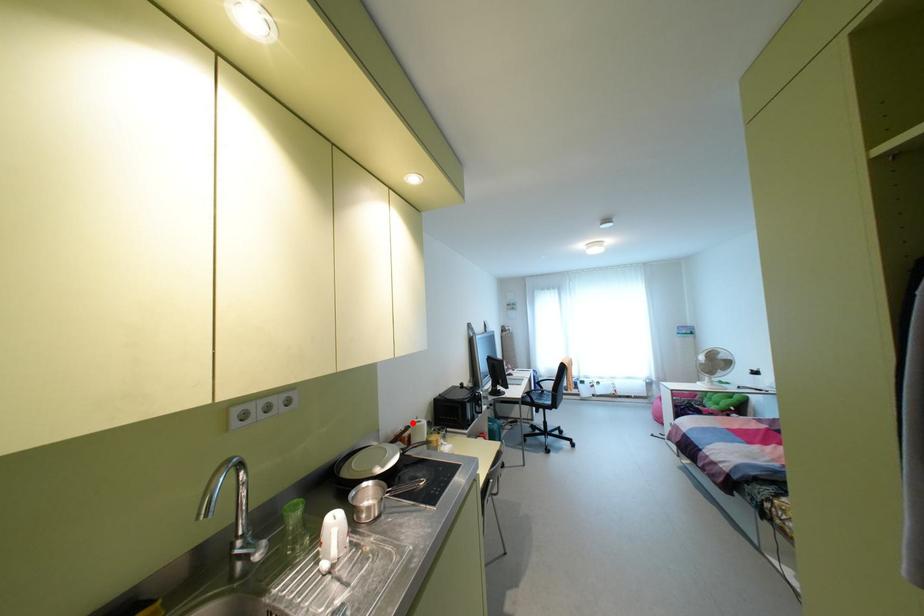
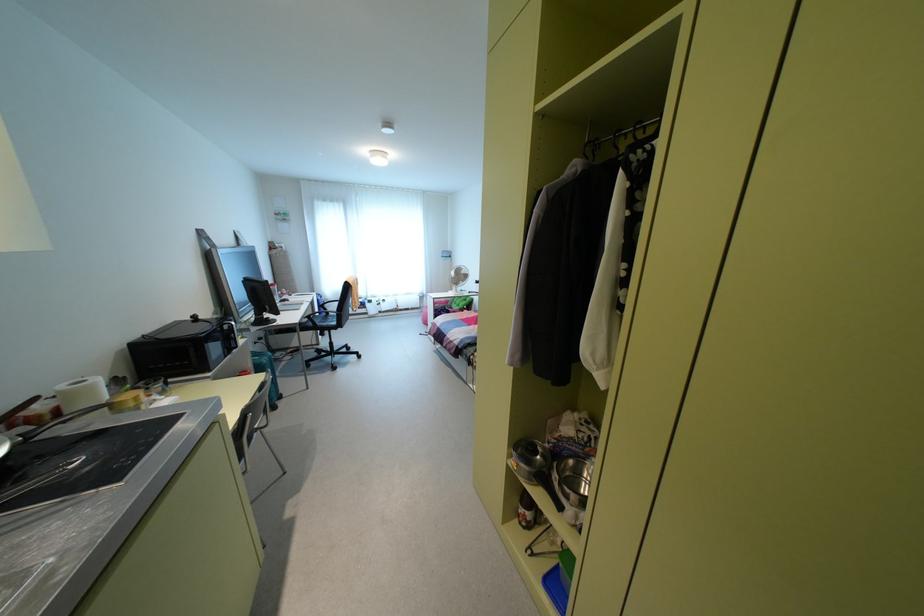
Locate, in the second image, the point that corresponds to the highlighted location in the first image.

(62, 387)